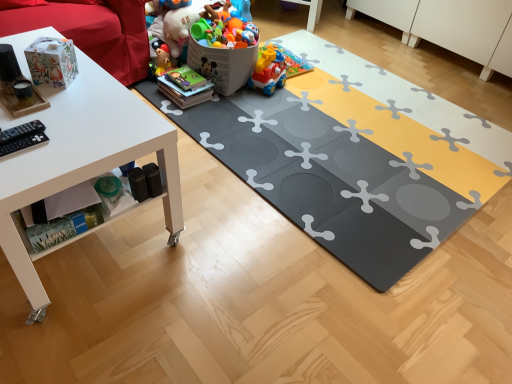
Question: Should I look upward or downward to see white matte table at left?

Choices:
 (A) up
 (B) down

Answer: (A)

Question: Considering the relative positions of plastic toy at center, acting as the second toy starting from the front, and matte paper bag at upper left, which appears as the 1th toy when viewed from the front, in the image provided, is plastic toy at center, acting as the second toy starting from the front, to the left of matte paper bag at upper left, which appears as the 1th toy when viewed from the front, from the viewer's perspective?

Choices:
 (A) no
 (B) yes

Answer: (A)

Question: Considering the relative positions of plastic toy at center, the third toy viewed from the back, and matte paper bag at upper left, placed as the fourth toy when sorted from back to front, in the image provided, is plastic toy at center, the third toy viewed from the back, to the right of matte paper bag at upper left, placed as the fourth toy when sorted from back to front, from the viewer's perspective?

Choices:
 (A) no
 (B) yes

Answer: (B)

Question: Is matte paper bag at upper left, placed as the fourth toy when sorted from back to front, at the back of plastic toy at center, the third toy viewed from the back?

Choices:
 (A) yes
 (B) no

Answer: (B)

Question: Can you see plastic toy at center, acting as the second toy starting from the front, touching matte paper bag at upper left, which appears as the 1th toy when viewed from the front?

Choices:
 (A) no
 (B) yes

Answer: (A)

Question: Can you confirm if plastic toy at center, the third toy viewed from the back, is shorter than matte paper bag at upper left, which appears as the 1th toy when viewed from the front?

Choices:
 (A) no
 (B) yes

Answer: (A)

Question: Can you confirm if plastic toy at center, the third toy viewed from the back, is wider than matte paper bag at upper left, placed as the fourth toy when sorted from back to front?

Choices:
 (A) yes
 (B) no

Answer: (A)

Question: Does gray rubber yoga mat at center appear on the left side of plastic multicolored toy train at center, the 4th toy in the front-to-back sequence?

Choices:
 (A) yes
 (B) no

Answer: (B)

Question: Can you confirm if gray rubber yoga mat at center is thinner than plastic multicolored toy train at center, the 4th toy in the front-to-back sequence?

Choices:
 (A) yes
 (B) no

Answer: (B)

Question: From the image's perspective, is gray rubber yoga mat at center located beneath plastic multicolored toy train at center, the 4th toy in the front-to-back sequence?

Choices:
 (A) no
 (B) yes

Answer: (B)

Question: Can you confirm if gray rubber yoga mat at center is taller than plastic multicolored toy train at center, arranged as the 1th toy when viewed from the back?

Choices:
 (A) yes
 (B) no

Answer: (B)

Question: Is gray rubber yoga mat at center not inside plastic multicolored toy train at center, arranged as the 1th toy when viewed from the back?

Choices:
 (A) no
 (B) yes

Answer: (B)

Question: From a real-world perspective, is gray rubber yoga mat at center physically above plastic multicolored toy train at center, arranged as the 1th toy when viewed from the back?

Choices:
 (A) no
 (B) yes

Answer: (A)

Question: Could you tell me if plastic toy at center, the third toy viewed from the back, is facing white matte table at left?

Choices:
 (A) yes
 (B) no

Answer: (B)